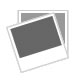
Identify the location of white frame. (56, 25), (31, 20), (12, 38), (19, 15), (41, 11), (65, 26).